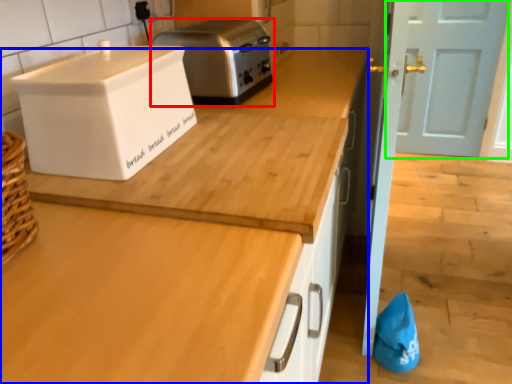
Question: Based on their relative distances, which object is farther from toaster (highlighted by a red box)? Choose from countertop (highlighted by a blue box) and door (highlighted by a green box).

Choices:
 (A) countertop
 (B) door

Answer: (B)